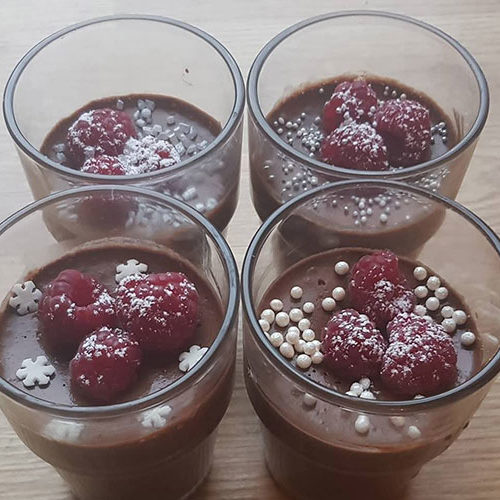
The width and height of the screenshot is (500, 500). Find the location of `butcher block`. butcher block is located at coordinates (246, 218).